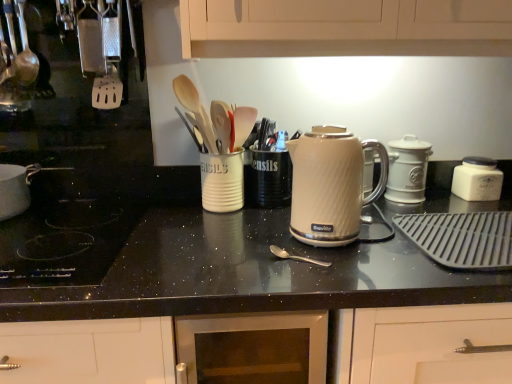
Question: Which direction should I rotate to look at silver metallic spoon at center, which ranks as the 2th utensil in top-to-bottom order?

Choices:
 (A) right
 (B) left

Answer: (A)

Question: Is white plastic spatula at left turned away from white ceramic container at right, positioned as the first kitchen appliance in back-to-front order?

Choices:
 (A) yes
 (B) no

Answer: (B)

Question: Can you confirm if white plastic spatula at left is wider than white ceramic container at right, the third kitchen appliance viewed from the left?

Choices:
 (A) no
 (B) yes

Answer: (A)

Question: Is white ceramic container at right, arranged as the 3th kitchen appliance when viewed from the front, located within white plastic spatula at left?

Choices:
 (A) yes
 (B) no

Answer: (B)

Question: Can you confirm if white plastic spatula at left is bigger than white ceramic container at right, positioned as the first kitchen appliance in back-to-front order?

Choices:
 (A) yes
 (B) no

Answer: (A)

Question: From the image's perspective, does white plastic spatula at left appear lower than white ceramic container at right, which ranks as the 1th kitchen appliance in right-to-left order?

Choices:
 (A) no
 (B) yes

Answer: (A)

Question: Are white plastic spatula at left and white ceramic container at right, the third kitchen appliance viewed from the left, located far from each other?

Choices:
 (A) no
 (B) yes

Answer: (B)

Question: Would you say white ribbed mug at center is outside black granite countertop at center?

Choices:
 (A) no
 (B) yes

Answer: (B)

Question: Can you confirm if white ribbed mug at center is bigger than black granite countertop at center?

Choices:
 (A) yes
 (B) no

Answer: (B)

Question: From the image's perspective, is white ribbed mug at center located above black granite countertop at center?

Choices:
 (A) no
 (B) yes

Answer: (B)

Question: Does white ribbed mug at center have a greater height compared to black granite countertop at center?

Choices:
 (A) yes
 (B) no

Answer: (B)

Question: From a real-world perspective, is white ribbed mug at center positioned under black granite countertop at center based on gravity?

Choices:
 (A) yes
 (B) no

Answer: (B)

Question: From the image's perspective, is white ribbed mug at center under black granite countertop at center?

Choices:
 (A) no
 (B) yes

Answer: (A)

Question: Considering the relative positions of silver metallic spoon at center, the 2th utensil when ordered from left to right, and cream matte electric kettle at center, which is counted as the first kitchen appliance, starting from the front, in the image provided, is silver metallic spoon at center, the 2th utensil when ordered from left to right, to the left of cream matte electric kettle at center, which is counted as the first kitchen appliance, starting from the front, from the viewer's perspective?

Choices:
 (A) no
 (B) yes

Answer: (B)